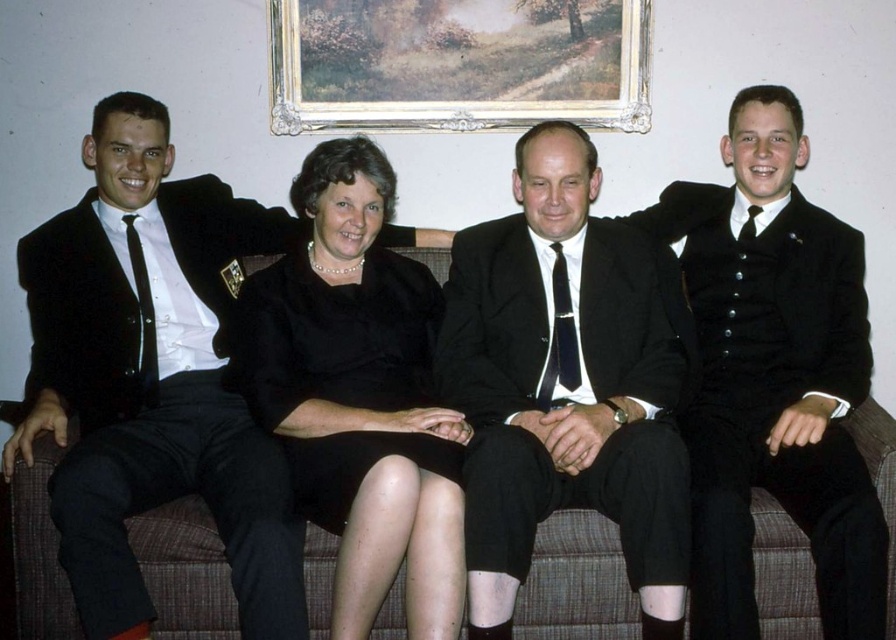
Consider the image. Does brown fabric couch at center have a larger size compared to black silk tie at center?

Indeed, brown fabric couch at center has a larger size compared to black silk tie at center.

Between point (253, 266) and point (560, 264), which one is positioned behind?

Positioned behind is point (253, 266).

Between point (751, 493) and point (565, 308), which one is positioned in front?

Point (751, 493)

Where is `brown fabric couch at center`? brown fabric couch at center is located at coordinates (576, 582).

Does black satin dress at center appear on the right side of black silk tie at center?

Incorrect, black satin dress at center is not on the right side of black silk tie at center.

Can you confirm if black satin dress at center is taller than black silk tie at center?

Indeed, black satin dress at center has a greater height compared to black silk tie at center.

Is point (415, 513) positioned behind point (561, 342)?

No, (415, 513) is in front of (561, 342).

Where is `black satin dress at center`? The height and width of the screenshot is (640, 896). black satin dress at center is located at coordinates coord(359,394).

Is point (711, 236) less distant than point (748, 205)?

No, it is not.

Who is positioned more to the left, black satin vest at right or black silk tie at right?

black satin vest at right

Is point (806, 372) closer to camera compared to point (748, 218)?

Yes.

Find the location of a particular element. The height and width of the screenshot is (640, 896). black satin vest at right is located at coordinates 774,376.